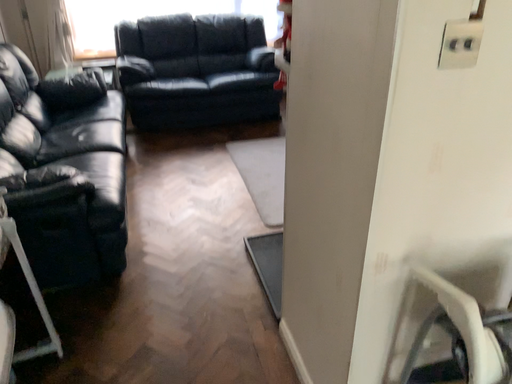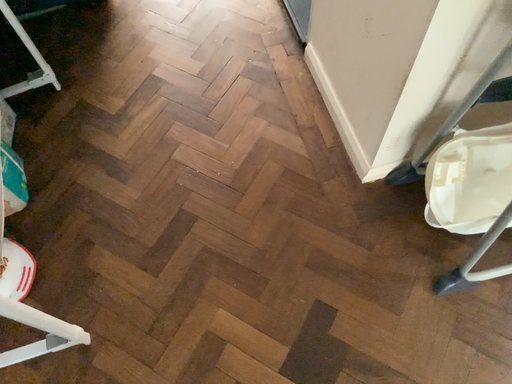
Question: How did the camera likely rotate when shooting the video?

Choices:
 (A) rotated upward
 (B) rotated downward

Answer: (B)